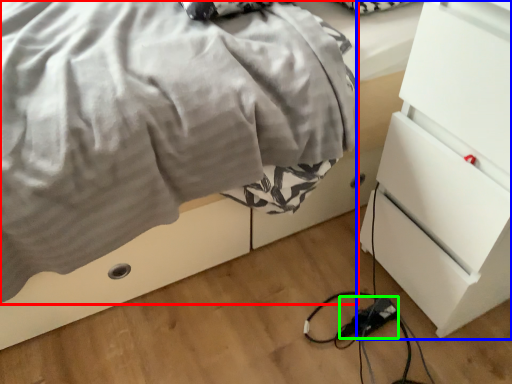
Question: Which object is the farthest from blanket (highlighted by a red box)? Choose among these: chest of drawers (highlighted by a blue box) or extension cord (highlighted by a green box).

Choices:
 (A) chest of drawers
 (B) extension cord

Answer: (B)